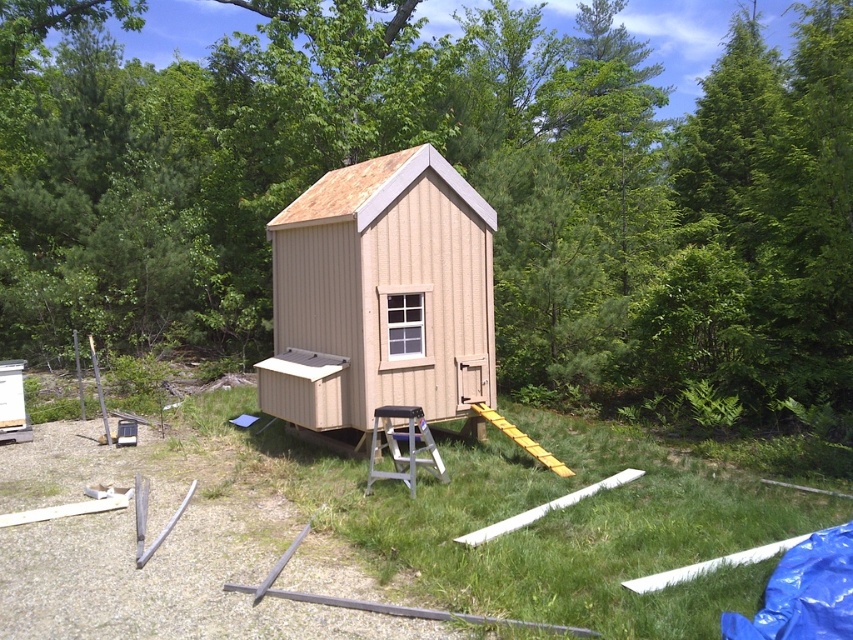
Which is above, tan wood cabin at center or yellow plastic ramp at center?

tan wood cabin at center

Can you confirm if tan wood cabin at center is bigger than yellow plastic ramp at center?

Correct, tan wood cabin at center is larger in size than yellow plastic ramp at center.

Does point (321, 333) lie in front of point (509, 433)?

No, it is behind (509, 433).

The height and width of the screenshot is (640, 853). In order to click on tan wood cabin at center in this screenshot , I will do `click(380, 296)`.

Between green leafy tree at center and yellow plastic ramp at center, which one has more height?

With more height is green leafy tree at center.

The width and height of the screenshot is (853, 640). In order to click on green leafy tree at center in this screenshot , I will do `click(460, 172)`.

Is point (26, 232) positioned in front of point (497, 413)?

No, (26, 232) is further to viewer.

Locate an element on the screen. This screenshot has height=640, width=853. green leafy tree at center is located at coordinates (460, 172).

Is tan wood cabin at center taller than silver metallic stool at center?

Indeed, tan wood cabin at center has a greater height compared to silver metallic stool at center.

Does point (471, 291) come farther from viewer compared to point (413, 436)?

Yes, point (471, 291) is farther from viewer.

Identify the location of tan wood cabin at center. (380, 296).

You are a GUI agent. You are given a task and a screenshot of the screen. Output one action in this format:
    pyautogui.click(x=<x>, y=<y>)
    Task: Click on the tan wood cabin at center
    The height and width of the screenshot is (640, 853).
    Given the screenshot: What is the action you would take?
    pyautogui.click(x=380, y=296)